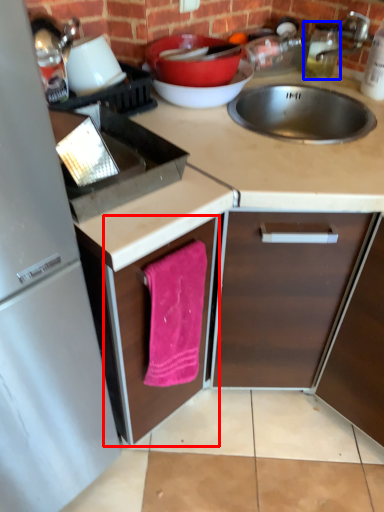
Question: Which object appears closest to the camera in this image, cabinetry (highlighted by a red box) or bottle (highlighted by a blue box)?

Choices:
 (A) cabinetry
 (B) bottle

Answer: (A)